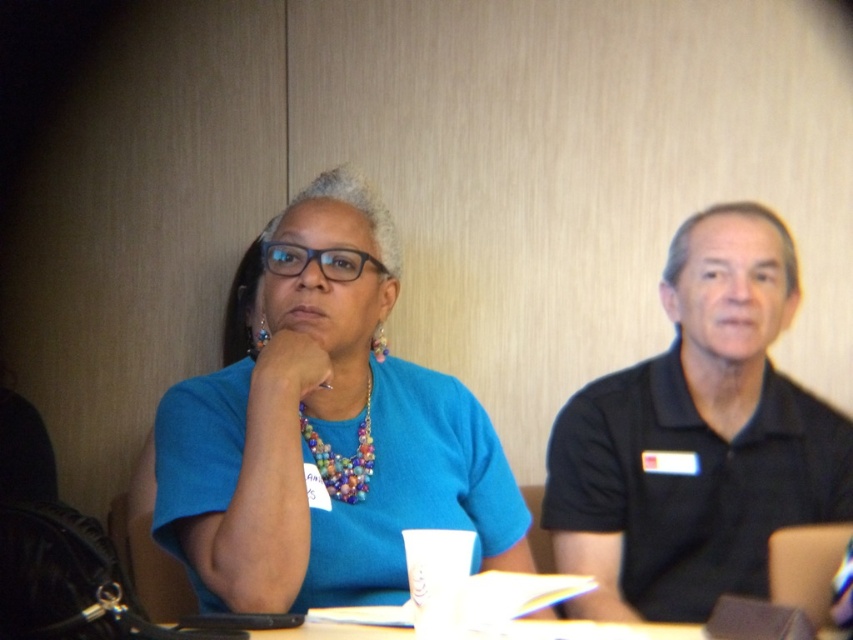
You are organizing a workshop and need to ensure that all participants have access to both the black polo shirt at right and the transparent plastic glasses at center. Given their sizes, which item would require more storage space when packing them away?

The black polo shirt at right requires more storage space because it has a larger size compared to the transparent plastic glasses at center.

You are organizing a photo shoot and need to arrange the two shirts in a way that matches their original positions. If you place the black polo shirt at right on the table, where should you position the blue fabric shirt at center relative to it?

The blue fabric shirt at center should be placed above the black polo shirt at right to maintain their original positions as described.

You are standing in the conference room and want to locate the point at coordinates (325, 440). Which object in the scene is this point located on?

The point at coordinates (325, 440) is located on the blue fabric shirt at center.